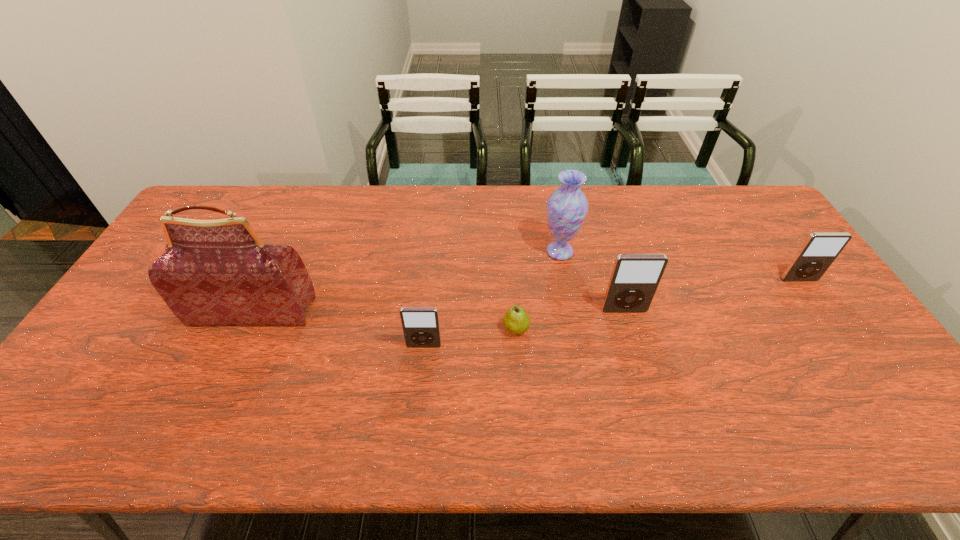
This screenshot has width=960, height=540. In order to click on free space that is in between the shortest object and the second object from left to right in this screenshot , I will do `click(470, 338)`.

The width and height of the screenshot is (960, 540). What are the coordinates of `empty space between the second object from left to right and the vase` in the screenshot? It's located at (492, 299).

The image size is (960, 540). What are the coordinates of `free space between the tallest object and the nearest iPod` in the screenshot? It's located at (338, 329).

Identify which object is the fifth nearest to the shortest object. Please provide its 2D coordinates. Your answer should be formatted as a tuple, i.e. [(x, y)], where the tuple contains the x and y coordinates of a point satisfying the conditions above.

[(820, 249)]

Where is `object that stands as the second closest to the tallest object`? Image resolution: width=960 pixels, height=540 pixels. object that stands as the second closest to the tallest object is located at coordinates (516, 320).

Locate an element on the screen. iPod that is the second closest to the nearest object is located at coordinates (820, 249).

Identify which iPod is located as the third nearest to the tallest object. Please provide its 2D coordinates. Your answer should be formatted as a tuple, i.e. [(x, y)], where the tuple contains the x and y coordinates of a point satisfying the conditions above.

[(820, 249)]